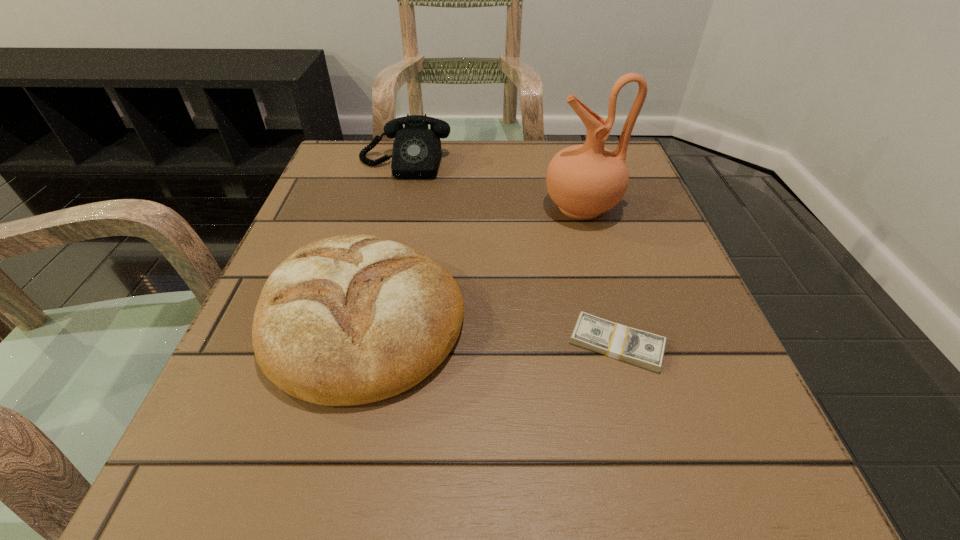
Where is `the tallest object`? Image resolution: width=960 pixels, height=540 pixels. the tallest object is located at coordinates (585, 180).

You are a GUI agent. You are given a task and a screenshot of the screen. Output one action in this format:
    pyautogui.click(x=<x>, y=<y>)
    Task: Click on the second farthest object
    The height and width of the screenshot is (540, 960).
    Given the screenshot: What is the action you would take?
    pyautogui.click(x=585, y=180)

Find the location of `the farthest object`. the farthest object is located at coordinates (416, 154).

At what (x,y) coordinates should I click in order to perform the action: click on bread. Please return your answer as a coordinate pair (x, y). Looking at the image, I should click on (353, 319).

Find the location of a particular element. The image size is (960, 540). dollar is located at coordinates (640, 348).

Identify the location of vacant space located on the spout of the pottery. (351, 207).

Where is `vacant space located on the spout of the pottery`? This screenshot has height=540, width=960. vacant space located on the spout of the pottery is located at coordinates [x=469, y=207].

The height and width of the screenshot is (540, 960). I want to click on free space located 0.290m on the spout of the pottery, so click(400, 207).

Locate an element on the screen. This screenshot has height=540, width=960. vacant space located on the dial of the farthest object is located at coordinates (372, 296).

You are a GUI agent. You are given a task and a screenshot of the screen. Output one action in this format:
    pyautogui.click(x=<x>, y=<y>)
    Task: Click on the vacant space situated 0.060m on the front of the bread
    
    Given the screenshot: What is the action you would take?
    pyautogui.click(x=330, y=456)